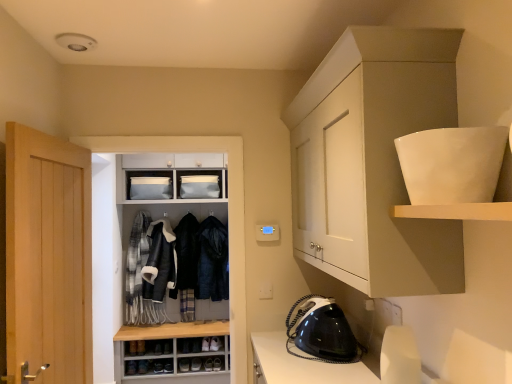
Question: Should I look upward or downward to see plaid wool scarf at center left, which is the fourth clothing in right-to-left order?

Choices:
 (A) up
 (B) down

Answer: (B)

Question: Considering the relative positions of dark blue fur-lined coat at center, which ranks as the fourth clothing in left-to-right order, and leather jacket at center, arranged as the third clothing when viewed from the right, in the image provided, is dark blue fur-lined coat at center, which ranks as the fourth clothing in left-to-right order, behind leather jacket at center, arranged as the third clothing when viewed from the right,?

Choices:
 (A) no
 (B) yes

Answer: (B)

Question: From the image's perspective, is dark blue fur-lined coat at center, which is the 1th clothing in right-to-left order, under leather jacket at center, arranged as the third clothing when viewed from the right?

Choices:
 (A) no
 (B) yes

Answer: (B)

Question: From a real-world perspective, is dark blue fur-lined coat at center, which is the 1th clothing in right-to-left order, under leather jacket at center, arranged as the third clothing when viewed from the right?

Choices:
 (A) yes
 (B) no

Answer: (A)

Question: Is dark blue fur-lined coat at center, which ranks as the fourth clothing in left-to-right order, shorter than leather jacket at center, arranged as the third clothing when viewed from the right?

Choices:
 (A) no
 (B) yes

Answer: (A)

Question: Is dark blue fur-lined coat at center, which ranks as the fourth clothing in left-to-right order, smaller than leather jacket at center, arranged as the third clothing when viewed from the right?

Choices:
 (A) no
 (B) yes

Answer: (B)

Question: Is dark blue fur-lined coat at center, which ranks as the fourth clothing in left-to-right order, positioned far away from leather jacket at center, placed as the 2th clothing when sorted from left to right?

Choices:
 (A) no
 (B) yes

Answer: (A)

Question: Is white glossy bowl at upper right, marked as the 2th shelf in a bottom-to-top arrangement, oriented away from dark blue fur-lined coat at center, which ranks as the fourth clothing in left-to-right order?

Choices:
 (A) yes
 (B) no

Answer: (B)

Question: From the image's perspective, is white glossy bowl at upper right, which is counted as the 1th shelf, starting from the top, over dark blue fur-lined coat at center, which ranks as the fourth clothing in left-to-right order?

Choices:
 (A) yes
 (B) no

Answer: (A)

Question: Does white glossy bowl at upper right, marked as the 2th shelf in a bottom-to-top arrangement, contain dark blue fur-lined coat at center, which ranks as the fourth clothing in left-to-right order?

Choices:
 (A) yes
 (B) no

Answer: (B)

Question: Does white glossy bowl at upper right, which is counted as the 1th shelf, starting from the top, appear on the left side of dark blue fur-lined coat at center, which ranks as the fourth clothing in left-to-right order?

Choices:
 (A) no
 (B) yes

Answer: (A)

Question: Is white glossy bowl at upper right, which is counted as the 1th shelf, starting from the top, not inside dark blue fur-lined coat at center, which ranks as the fourth clothing in left-to-right order?

Choices:
 (A) no
 (B) yes

Answer: (B)

Question: Does white glossy bowl at upper right, marked as the 2th shelf in a bottom-to-top arrangement, have a lesser height compared to dark blue fur-lined coat at center, which is the 1th clothing in right-to-left order?

Choices:
 (A) no
 (B) yes

Answer: (B)

Question: Does white matte shelf at upper right, positioned as the second shelf in top-to-bottom order, appear on the right side of light wood door at left?

Choices:
 (A) yes
 (B) no

Answer: (A)